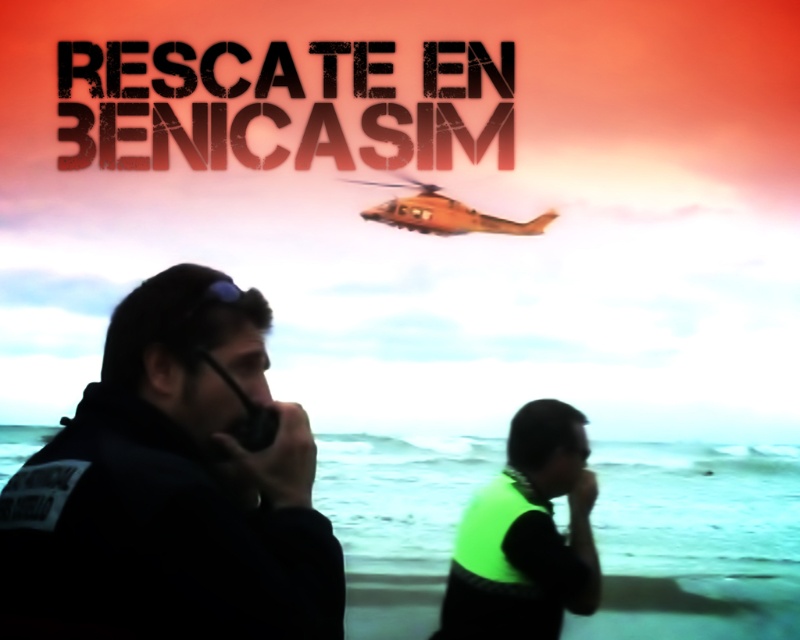
Question: Can you confirm if black fabric uniform at left is positioned to the right of neon green vest at center?

Choices:
 (A) no
 (B) yes

Answer: (A)

Question: Is neon green vest at center bigger than orange matte helicopter at upper center?

Choices:
 (A) yes
 (B) no

Answer: (A)

Question: Does orange matte helicopter at upper center have a larger size compared to black matte phone at center?

Choices:
 (A) no
 (B) yes

Answer: (B)

Question: Based on their relative distances, which object is farther from the neon green vest at center?

Choices:
 (A) black matte phone at center
 (B) black fabric uniform at left

Answer: (B)

Question: Considering the real-world distances, which object is closest to the orange matte helicopter at upper center?

Choices:
 (A) black fabric uniform at left
 (B) neon green vest at center
 (C) black matte phone at center

Answer: (B)

Question: Which is nearer to the black fabric uniform at left?

Choices:
 (A) black matte phone at center
 (B) orange matte helicopter at upper center

Answer: (A)